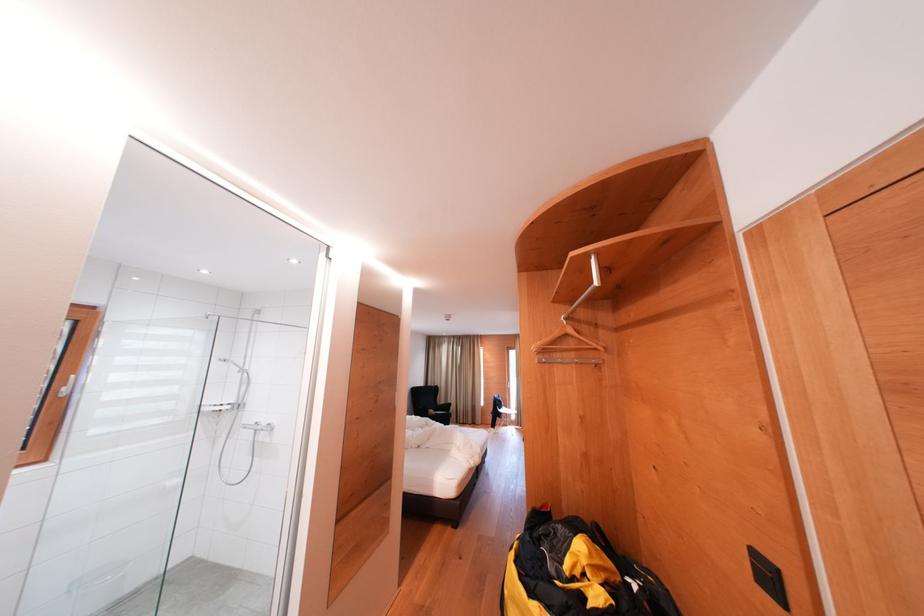
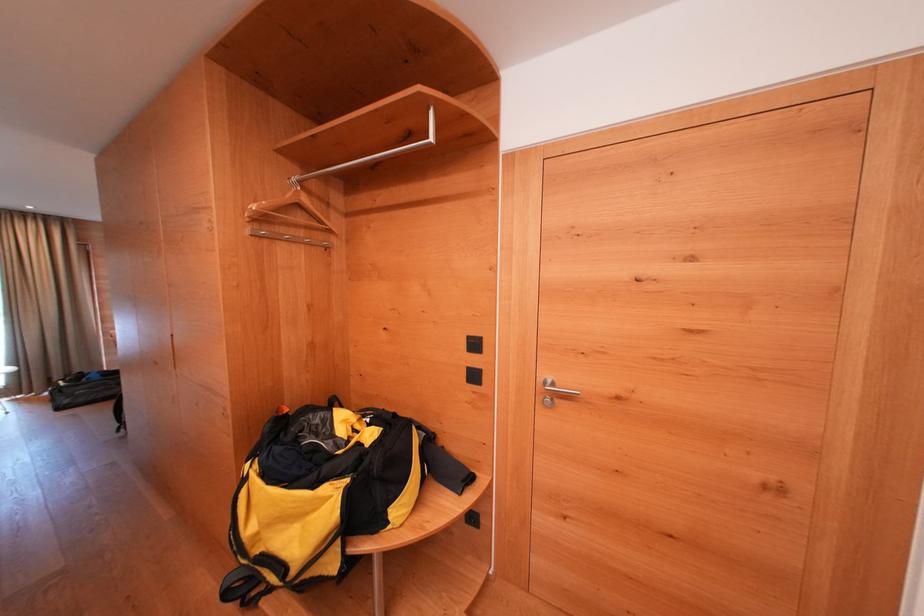
In the second image, find the point that corresponds to (577,334) in the first image.

(312, 205)